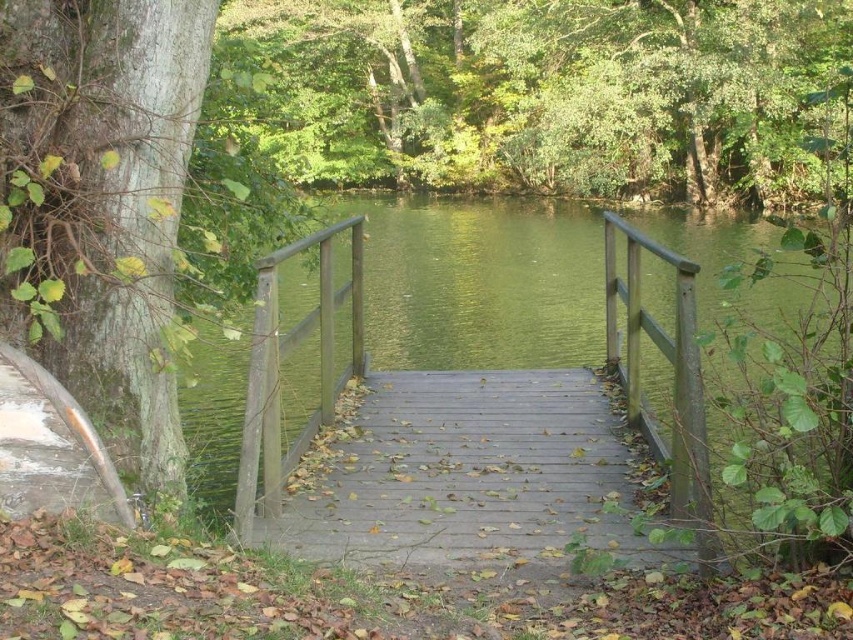
Question: Which point is farther from the camera taking this photo?

Choices:
 (A) (253, 458)
 (B) (410, 509)

Answer: (B)

Question: Does wooden bridge at center appear on the right side of wooden rail at center?

Choices:
 (A) no
 (B) yes

Answer: (B)

Question: Is green leafy tree at upper center above green rough bark tree at left?

Choices:
 (A) no
 (B) yes

Answer: (B)

Question: Observing the image, what is the correct spatial positioning of green leafy tree at upper center in reference to green rough bark tree at left?

Choices:
 (A) above
 (B) below

Answer: (A)

Question: Which object is positioned closest to the green rough bark tree at left?

Choices:
 (A) green leafy tree at upper center
 (B) wooden rail at center

Answer: (B)

Question: Which point is closer to the camera taking this photo?

Choices:
 (A) (158, 220)
 (B) (776, 26)
 (C) (611, 468)
 (D) (276, 253)

Answer: (A)